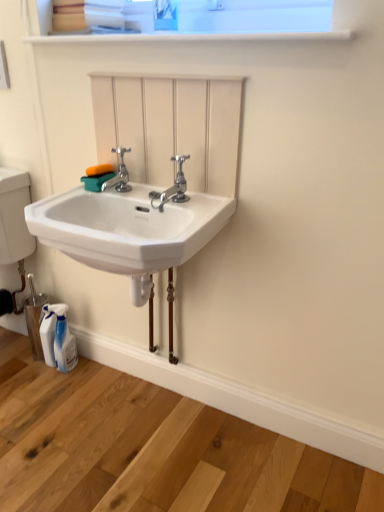
Where is `vacant space in white ceramic sink at center (from a real-world perspective)`? The image size is (384, 512). vacant space in white ceramic sink at center (from a real-world perspective) is located at coordinates (137, 418).